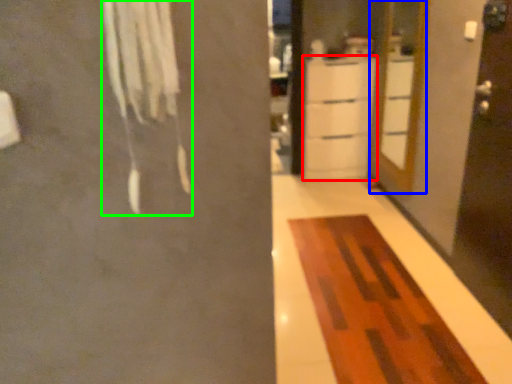
Question: Estimate the real-world distances between objects in this image. Which object is closer to cabinetry (highlighted by a red box), door (highlighted by a blue box) or laundry (highlighted by a green box)?

Choices:
 (A) door
 (B) laundry

Answer: (A)